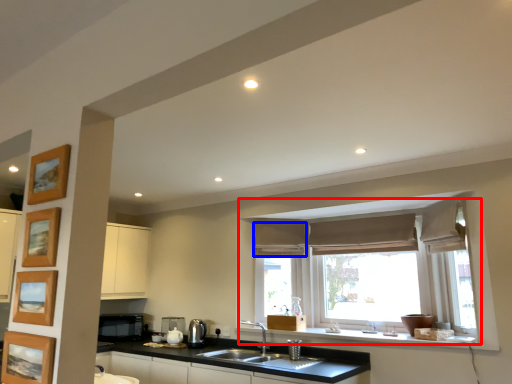
Question: Which object appears farthest to the camera in this image, window (highlighted by a red box) or curtain (highlighted by a blue box)?

Choices:
 (A) window
 (B) curtain

Answer: (B)